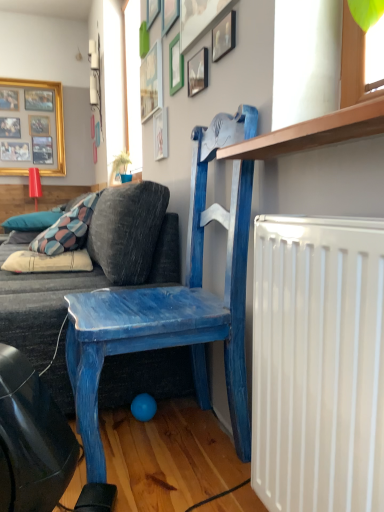
Question: Considering the relative positions of blue painted wood chair at upper center and wooden picture frame at upper center, which appears as the third picture frame when viewed from the left, in the image provided, is blue painted wood chair at upper center to the right of wooden picture frame at upper center, which appears as the third picture frame when viewed from the left, from the viewer's perspective?

Choices:
 (A) yes
 (B) no

Answer: (A)

Question: Is blue painted wood chair at upper center with wooden picture frame at upper center, which appears as the third picture frame when viewed from the left?

Choices:
 (A) yes
 (B) no

Answer: (B)

Question: Could you tell me if blue painted wood chair at upper center is facing wooden picture frame at upper center, the 6th picture frame positioned from the right?

Choices:
 (A) yes
 (B) no

Answer: (B)

Question: Is blue painted wood chair at upper center to the left of wooden picture frame at upper center, placed as the 4th picture frame when sorted from back to front, from the viewer's perspective?

Choices:
 (A) yes
 (B) no

Answer: (B)

Question: Is blue painted wood chair at upper center surrounding wooden picture frame at upper center, placed as the 4th picture frame when sorted from back to front?

Choices:
 (A) yes
 (B) no

Answer: (B)

Question: Considering the positions of patterned fabric pillow at lower left, acting as the second pillow starting from the bottom, and wooden picture frame at upper center, the 2th picture frame from the front, in the image, is patterned fabric pillow at lower left, acting as the second pillow starting from the bottom, wider or thinner than wooden picture frame at upper center, the 2th picture frame from the front,?

Choices:
 (A) thin
 (B) wide

Answer: (B)

Question: In terms of height, does patterned fabric pillow at lower left, acting as the 1th pillow starting from the back, look taller or shorter compared to wooden picture frame at upper center, the 2th picture frame from the front?

Choices:
 (A) tall
 (B) short

Answer: (A)

Question: In the image, is patterned fabric pillow at lower left, which appears as the first pillow when viewed from the left, positioned in front of or behind wooden picture frame at upper center, the 2th picture frame from the front?

Choices:
 (A) front
 (B) behind

Answer: (B)

Question: Does point (51, 223) appear closer or farther from the camera than point (206, 65)?

Choices:
 (A) farther
 (B) closer

Answer: (A)

Question: Does point (46, 224) appear closer or farther from the camera than point (165, 150)?

Choices:
 (A) farther
 (B) closer

Answer: (A)

Question: From their relative heights in the image, would you say patterned fabric pillow at lower left, marked as the second pillow in a right-to-left arrangement, is taller or shorter than wooden picture frame at upper center, which appears as the 5th picture frame when viewed from the right?

Choices:
 (A) short
 (B) tall

Answer: (A)

Question: Looking at the image, does patterned fabric pillow at lower left, acting as the second pillow starting from the bottom, seem bigger or smaller compared to wooden picture frame at upper center, marked as the sixth picture frame in a front-to-back arrangement?

Choices:
 (A) big
 (B) small

Answer: (A)

Question: From the image's perspective, is patterned fabric pillow at lower left, marked as the second pillow in a right-to-left arrangement, positioned above or below wooden picture frame at upper center, marked as the sixth picture frame in a front-to-back arrangement?

Choices:
 (A) above
 (B) below

Answer: (B)

Question: Is point (34, 226) positioned closer to the camera than point (84, 384)?

Choices:
 (A) farther
 (B) closer

Answer: (A)

Question: Is patterned fabric pillow at lower left, marked as the second pillow in a right-to-left arrangement, to the left or to the right of blue painted wood chair at upper center in the image?

Choices:
 (A) left
 (B) right

Answer: (A)